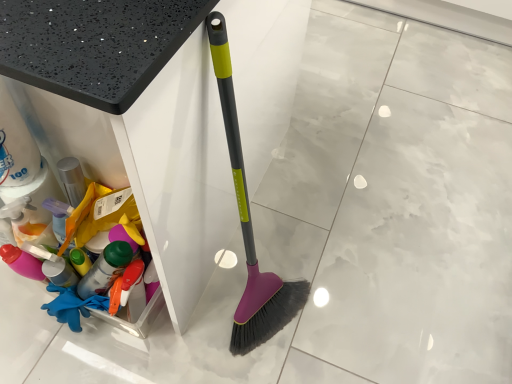
Describe the element at coordinates (23, 163) in the screenshot. I see `white glossy toilet paper at left` at that location.

Identify the location of white glossy toilet paper at left. This screenshot has width=512, height=384. (23, 163).

Locate an element on the screen. This screenshot has height=384, width=512. white glossy toilet paper at left is located at coordinates (23, 163).